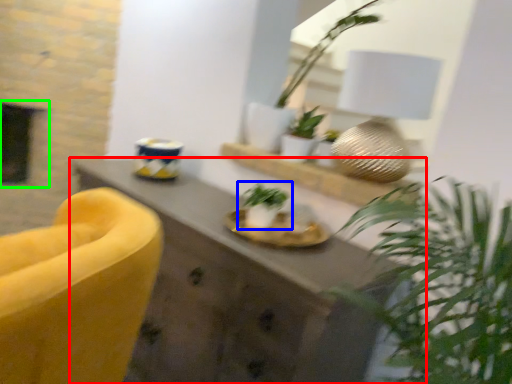
Question: Estimate the real-world distances between objects in this image. Which object is farther from desk (highlighted by a red box), houseplant (highlighted by a blue box) or fireplace (highlighted by a green box)?

Choices:
 (A) houseplant
 (B) fireplace

Answer: (B)